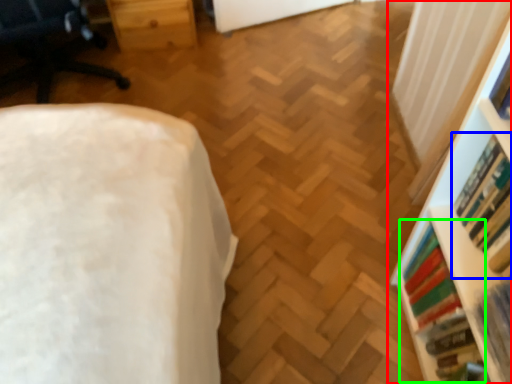
Question: Considering the real-world distances, which object is farthest from shelf (highlighted by a red box)? book (highlighted by a blue box) or book (highlighted by a green box)?

Choices:
 (A) book
 (B) book

Answer: (A)